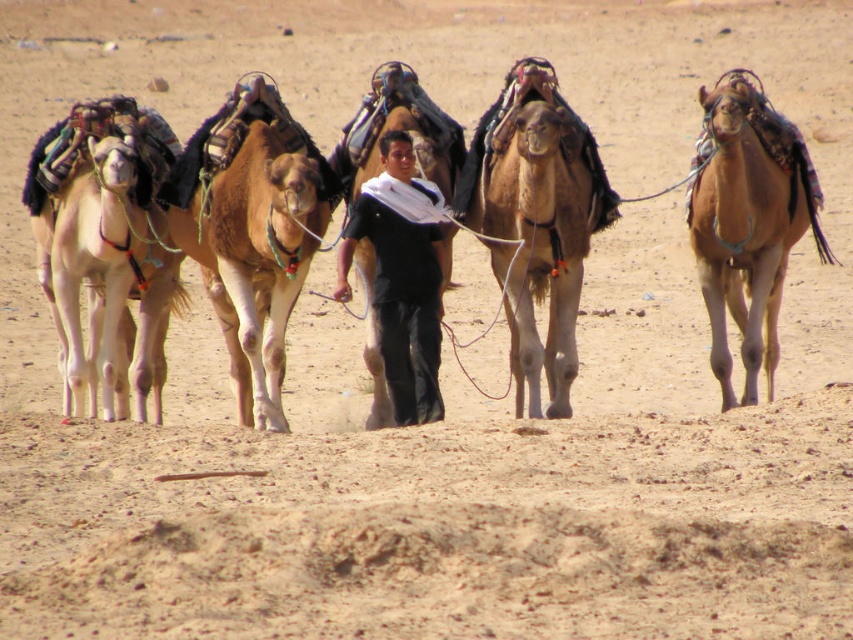
Is brown fuzzy camel at center to the right of brown matte camel at right from the viewer's perspective?

No, brown fuzzy camel at center is not to the right of brown matte camel at right.

In the scene shown: Is brown fuzzy camel at center positioned behind brown matte camel at right?

No, it is not.

In order to click on brown fuzzy camel at center in this screenshot , I will do `click(537, 220)`.

Can you confirm if brown textured camel at center is positioned above brown matte camel at right?

Correct, brown textured camel at center is located above brown matte camel at right.

Is brown textured camel at center smaller than brown matte camel at right?

Yes.

What do you see at coordinates (251, 230) in the screenshot?
I see `brown textured camel at center` at bounding box center [251, 230].

Image resolution: width=853 pixels, height=640 pixels. In order to click on brown textured camel at center in this screenshot , I will do `click(251, 230)`.

Can you confirm if brown fuzzy camel at center is positioned above light beige fabric camel at left?

Incorrect, brown fuzzy camel at center is not positioned above light beige fabric camel at left.

Between brown fuzzy camel at center and light beige fabric camel at left, which one appears on the right side from the viewer's perspective?

Positioned to the right is brown fuzzy camel at center.

At what (x,y) coordinates should I click in order to perform the action: click on brown fuzzy camel at center. Please return your answer as a coordinate pair (x, y). This screenshot has height=640, width=853. Looking at the image, I should click on click(x=537, y=220).

What are the coordinates of `brown fuzzy camel at center` in the screenshot? It's located at (537, 220).